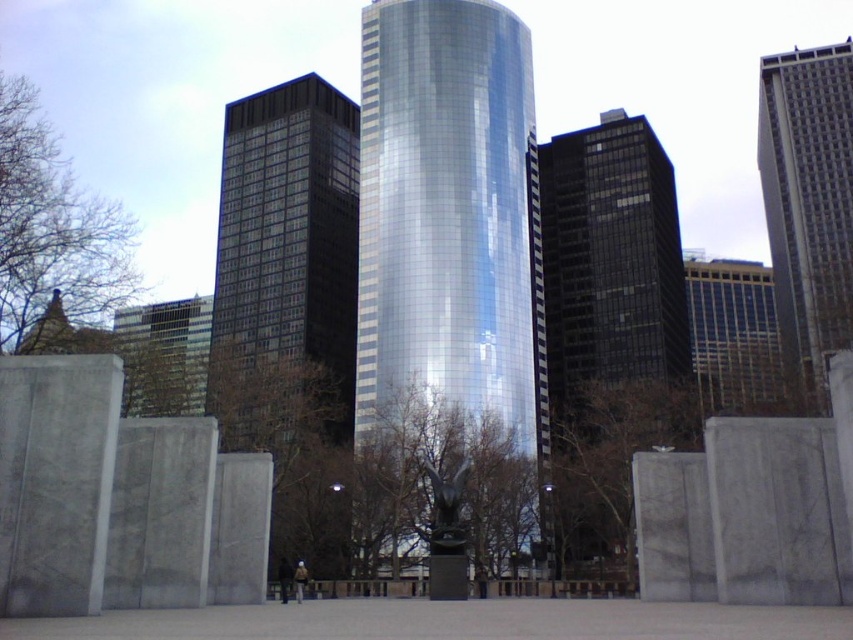
Where is `glossy glass tower at center`? glossy glass tower at center is located at coordinates (450, 216).

Between glossy glass tower at center and glossy glass skyscraper at center, which one is positioned lower?

glossy glass skyscraper at center is lower down.

This screenshot has width=853, height=640. I want to click on glossy glass tower at center, so click(450, 216).

Is black glass building at center below matte glass building at center?

Incorrect, black glass building at center is not positioned below matte glass building at center.

Find the location of a particular element. Image resolution: width=853 pixels, height=640 pixels. black glass building at center is located at coordinates (289, 305).

This screenshot has width=853, height=640. I want to click on black glass building at center, so click(289, 305).

Can you confirm if black glass building at center is positioned above gray concrete skyscraper at right?

No.

Between point (289, 420) and point (838, 136), which one is positioned in front?

Point (289, 420) is more forward.

This screenshot has width=853, height=640. In order to click on black glass building at center in this screenshot , I will do `click(289, 305)`.